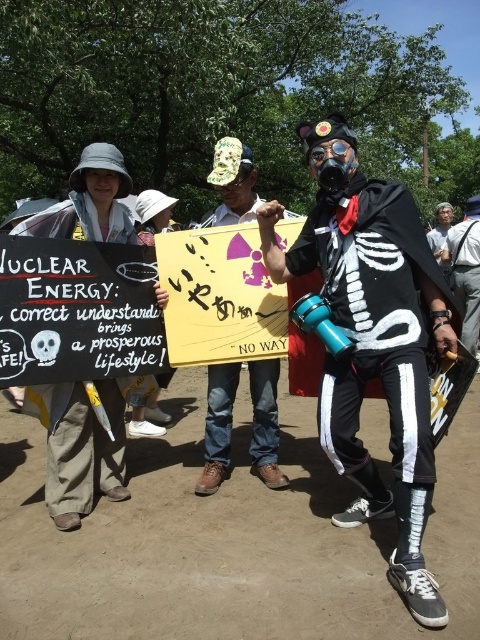
Question: Among these objects, which one is farthest from the camera?

Choices:
 (A) white cotton shirt at center
 (B) black matte skeleton costume at center

Answer: (A)

Question: Can you confirm if black matte skeleton costume at center is positioned above white cotton shirt at center?

Choices:
 (A) no
 (B) yes

Answer: (A)

Question: Considering the relative positions of black matte skeleton costume at center and white cotton shirt at center in the image provided, where is black matte skeleton costume at center located with respect to white cotton shirt at center?

Choices:
 (A) below
 (B) above

Answer: (A)

Question: Is black matte skeleton costume at center bigger than white cotton shirt at center?

Choices:
 (A) no
 (B) yes

Answer: (A)

Question: Which of the following is the farthest from the observer?

Choices:
 (A) (380, 365)
 (B) (479, 280)

Answer: (B)

Question: Which object is closer to the camera taking this photo?

Choices:
 (A) black matte skeleton costume at center
 (B) white cotton shirt at center

Answer: (A)